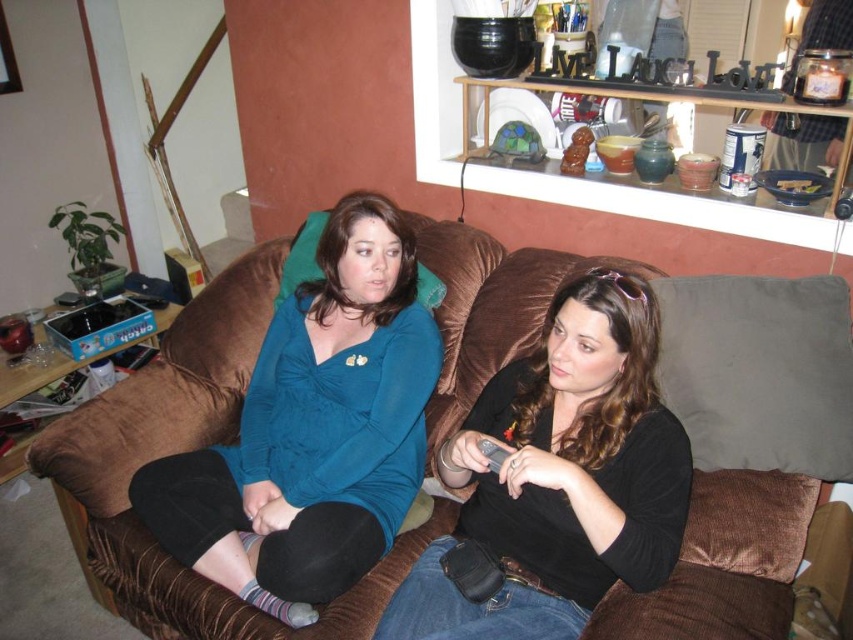
You are a photographer trying to capture a clear photo of the black plastic remote at center. However, the teal fabric shirt at center is blocking your view. Can you determine if the remote is underneath the shirt?

The teal fabric shirt at center is positioned over the black plastic remote at center, so yes, the remote is underneath the shirt and you can move the shirt to get a clear shot.

You are a photographer setting up a shoot in the living room. You need to place a small tripod in front of the brown corduroy couch at center so that it doesn t block the view of the teal fabric shirt at center. Is this possible given their positions?

The brown corduroy couch at center is positioned over the teal fabric shirt at center, so placing a tripod in front of the couch would block the view of the shirt. Choose another spot where the shirt is visible without obstruction.